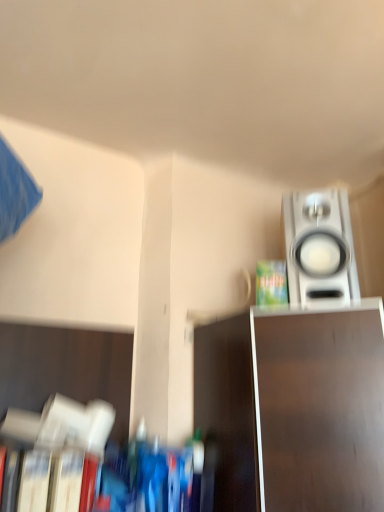
Question: Is metallic silver tv stand at lower right taller or shorter than green matte paperback book at upper right?

Choices:
 (A) tall
 (B) short

Answer: (A)

Question: Looking at their shapes, would you say metallic silver tv stand at lower right is wider or thinner than green matte paperback book at upper right?

Choices:
 (A) wide
 (B) thin

Answer: (A)

Question: Which object is positioned farthest from the hardcover book at lower left?

Choices:
 (A) satin silver speaker at upper right
 (B) metallic silver tv stand at lower right
 (C) green matte paperback book at upper right

Answer: (A)

Question: Considering the real-world distances, which object is closest to the satin silver speaker at upper right?

Choices:
 (A) green matte paperback book at upper right
 (B) hardcover book at lower left
 (C) metallic silver tv stand at lower right

Answer: (A)